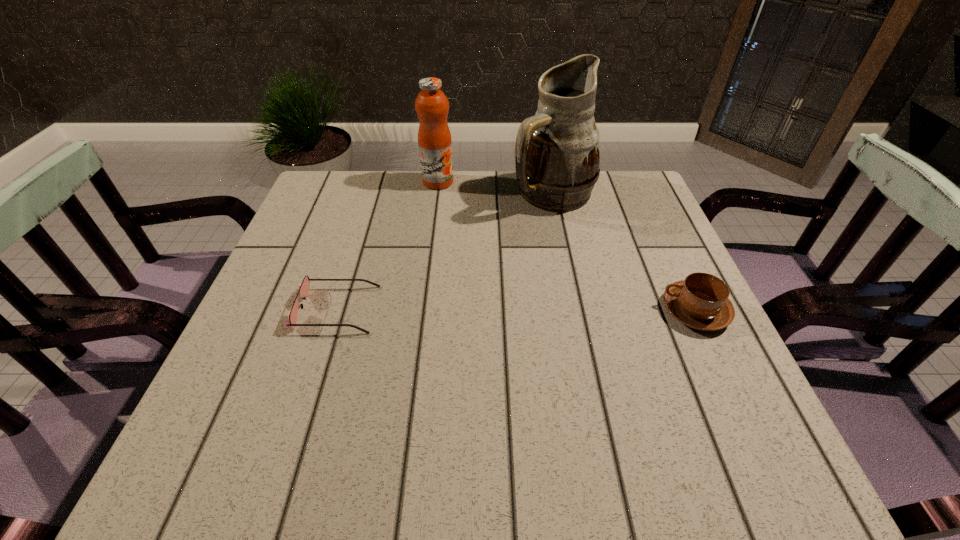
Identify the location of free space at the far right corner. The width and height of the screenshot is (960, 540). (605, 206).

The height and width of the screenshot is (540, 960). Find the location of `vacant space that's between the second shortest object and the second object from right to left`. vacant space that's between the second shortest object and the second object from right to left is located at coordinates (624, 252).

This screenshot has width=960, height=540. What are the coordinates of `free spot between the shortest object and the third object from right to left` in the screenshot? It's located at (388, 246).

At what (x,y) coordinates should I click in order to perform the action: click on free space between the second tallest object and the shortest object. Please return your answer as a coordinate pair (x, y). This screenshot has width=960, height=540. Looking at the image, I should click on (388, 246).

This screenshot has width=960, height=540. Identify the location of vacant area that lies between the fruit juice and the cappuccino. point(566,246).

You are a GUI agent. You are given a task and a screenshot of the screen. Output one action in this format:
    pyautogui.click(x=<x>, y=<y>)
    Task: Click on the free spot between the sunglasses and the third object from left to right
    The height and width of the screenshot is (540, 960).
    Given the screenshot: What is the action you would take?
    pyautogui.click(x=444, y=252)

Locate an element on the screen. unoccupied area between the sunglasses and the second shortest object is located at coordinates click(x=516, y=310).

Image resolution: width=960 pixels, height=540 pixels. In order to click on empty location between the second shortest object and the shortest object in this screenshot , I will do `click(516, 310)`.

Locate an element on the screen. The image size is (960, 540). free space between the third object from left to right and the leftmost object is located at coordinates (444, 252).

The height and width of the screenshot is (540, 960). I want to click on free space between the tallest object and the second shortest object, so click(x=624, y=252).